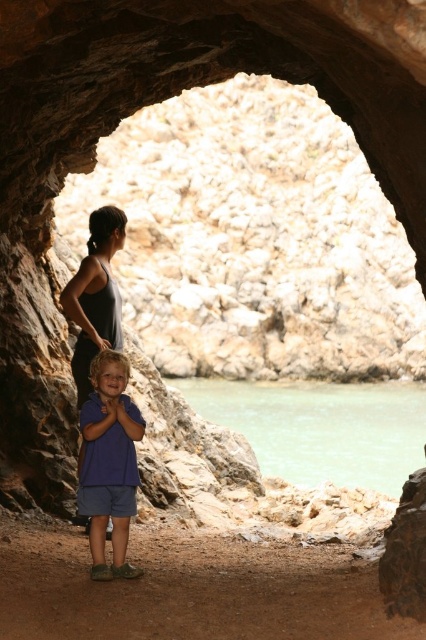
Is point (89, 516) positioned after point (74, 317)?

No, (89, 516) is closer to viewer.

Is blue cotton shirt at center shorter than matte gray tank top at center?

No, blue cotton shirt at center is not shorter than matte gray tank top at center.

Is point (129, 401) behind point (121, 337)?

That is False.

Where is `blue cotton shirt at center`? The image size is (426, 640). blue cotton shirt at center is located at coordinates (109, 461).

Who is positioned more to the left, matte gray tank top at center or rusty rock at lower right?

matte gray tank top at center

Which is in front, point (85, 336) or point (417, 497)?

Positioned in front is point (417, 497).

Between point (92, 333) and point (425, 592), which one is positioned behind?

The point (92, 333) is behind.

The width and height of the screenshot is (426, 640). Find the location of `matte gray tank top at center`. matte gray tank top at center is located at coordinates coord(95,296).

Between green water at lower center and matte gray tank top at center, which one appears on the right side from the viewer's perspective?

Positioned to the right is green water at lower center.

Identify the location of green water at lower center. This screenshot has height=640, width=426. (322, 428).

Identify the location of green water at lower center. (322, 428).